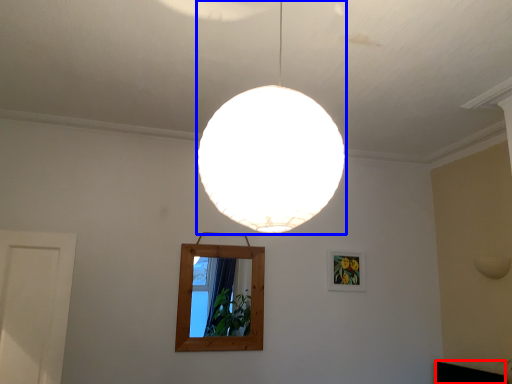
Question: Which object is closer to the camera taking this photo, furniture (highlighted by a red box) or lamp (highlighted by a blue box)?

Choices:
 (A) furniture
 (B) lamp

Answer: (B)